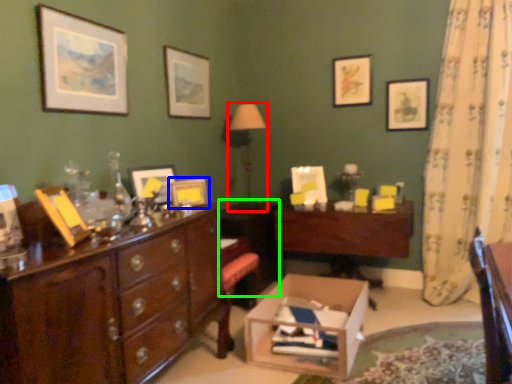
Question: Which is farther away from table lamp (highlighted by a red box)? picture frame (highlighted by a blue box) or cabinetry (highlighted by a green box)?

Choices:
 (A) picture frame
 (B) cabinetry

Answer: (A)